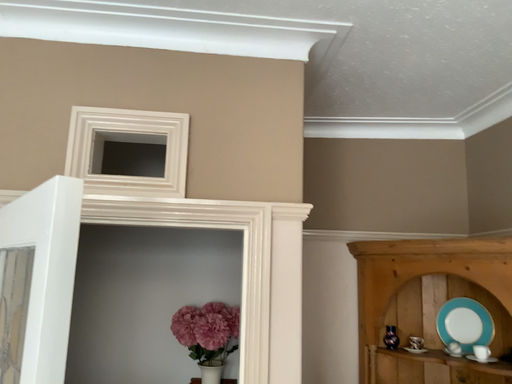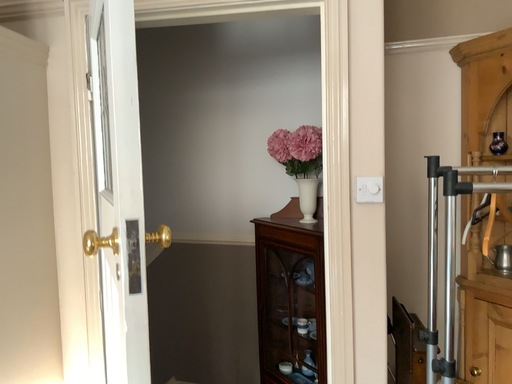
Question: How did the camera likely rotate when shooting the video?

Choices:
 (A) rotated right
 (B) rotated left

Answer: (B)